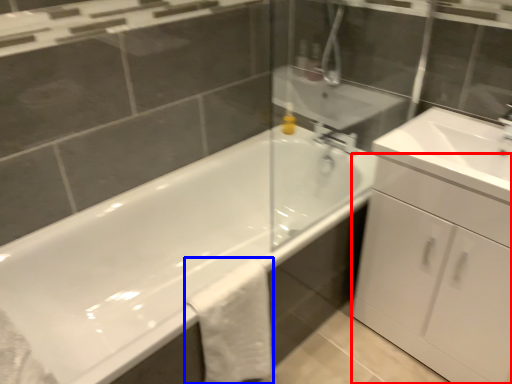
Question: Which object appears farthest to the camera in this image, cabinetry (highlighted by a red box) or bath towel (highlighted by a blue box)?

Choices:
 (A) cabinetry
 (B) bath towel

Answer: (B)